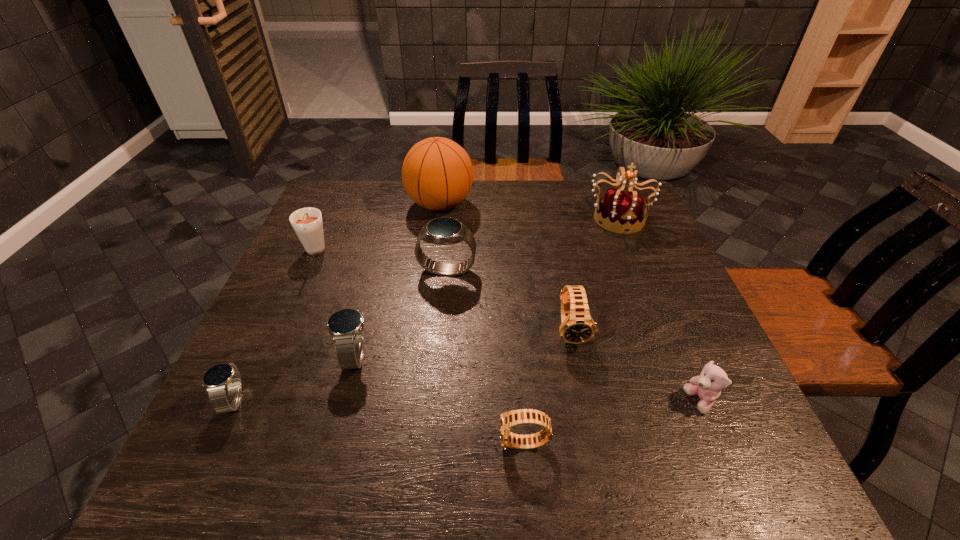
Choose which object is the seventh nearest neighbor to the nearest object. Please provide its 2D coordinates. Your answer should be formatted as a tuple, i.e. [(x, y)], where the tuple contains the x and y coordinates of a point satisfying the conditions above.

[(307, 223)]

Where is `object that stands as the closest to the second blue watch from right to left`? Image resolution: width=960 pixels, height=540 pixels. object that stands as the closest to the second blue watch from right to left is located at coordinates (216, 379).

Identify which watch is the third closest to the sixth object from left to right. Please provide its 2D coordinates. Your answer should be formatted as a tuple, i.e. [(x, y)], where the tuple contains the x and y coordinates of a point satisfying the conditions above.

[(443, 230)]

The width and height of the screenshot is (960, 540). I want to click on watch that is the fourth closest one to the red tiara, so click(346, 326).

Identify which blue watch is located as the second nearest to the root beer. Please provide its 2D coordinates. Your answer should be formatted as a tuple, i.e. [(x, y)], where the tuple contains the x and y coordinates of a point satisfying the conditions above.

[(346, 326)]

Identify which blue watch is the nearest to the leftmost blue watch. Please provide its 2D coordinates. Your answer should be formatted as a tuple, i.e. [(x, y)], where the tuple contains the x and y coordinates of a point satisfying the conditions above.

[(346, 326)]

The width and height of the screenshot is (960, 540). Identify the location of vacant position in the image that satisfies the following two spatial constraints: 1. on the front side of the orange basketball; 2. on the right side of the farthest blue watch. (432, 271).